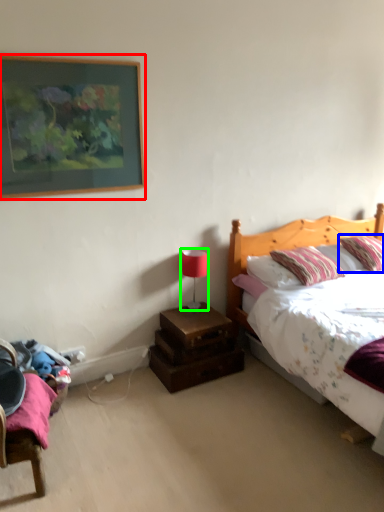
Question: Which object is positioned farthest from picture frame (highlighted by a red box)? Select from pillow (highlighted by a blue box) and table lamp (highlighted by a green box).

Choices:
 (A) pillow
 (B) table lamp

Answer: (A)